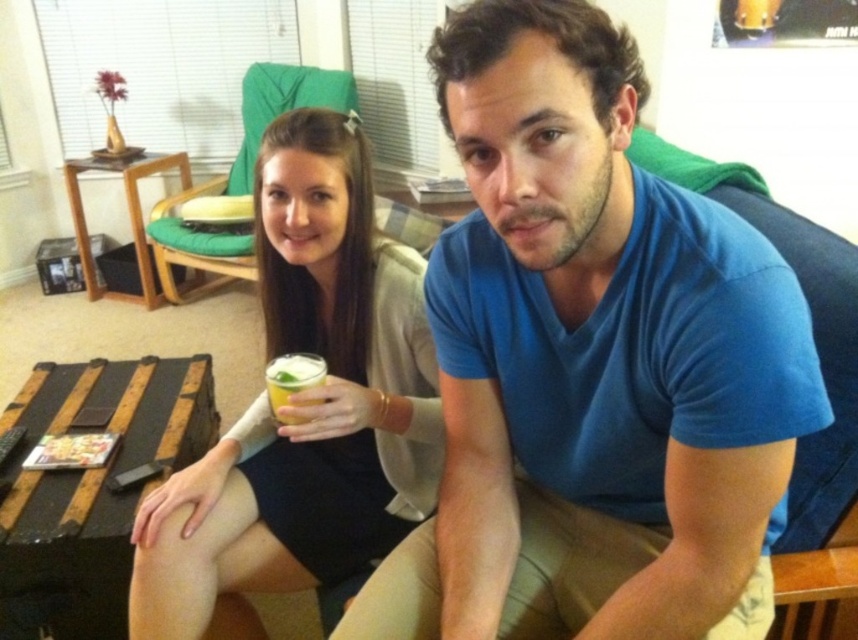
Is point (346, 406) closer to viewer compared to point (313, 376)?

No, it is behind (313, 376).

Which is below, matte black dress at center or translucent plastic cup at center?

translucent plastic cup at center

What do you see at coordinates (307, 397) in the screenshot? I see `matte black dress at center` at bounding box center [307, 397].

Image resolution: width=858 pixels, height=640 pixels. In order to click on matte black dress at center in this screenshot , I will do `click(307, 397)`.

Does blue cotton shirt at center come in front of matte black dress at center?

Yes, it is.

Who is shorter, blue cotton shirt at center or matte black dress at center?

With less height is blue cotton shirt at center.

Is point (631, 550) more distant than point (239, 484)?

No, (631, 550) is closer to viewer.

Where is `blue cotton shirt at center`? blue cotton shirt at center is located at coordinates tap(591, 365).

Which of these two, blue cotton shirt at center or translucent plastic cup at center, stands taller?

With more height is blue cotton shirt at center.

Between point (756, 522) and point (295, 372), which one is positioned in front?

Point (756, 522) is more forward.

Does point (727, 438) lie behind point (284, 356)?

That is False.

What are the coordinates of `blue cotton shirt at center` in the screenshot? It's located at (591, 365).